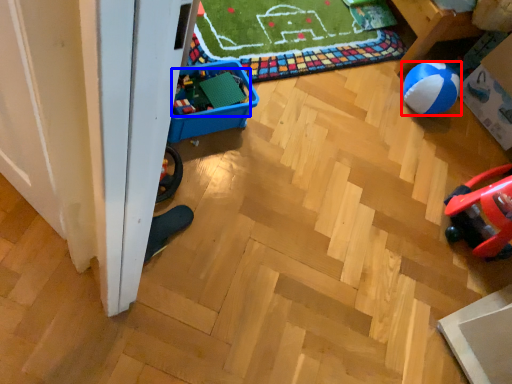
Question: Among these objects, which one is nearest to the camera, ball (highlighted by a red box) or toy (highlighted by a blue box)?

Choices:
 (A) ball
 (B) toy

Answer: (B)